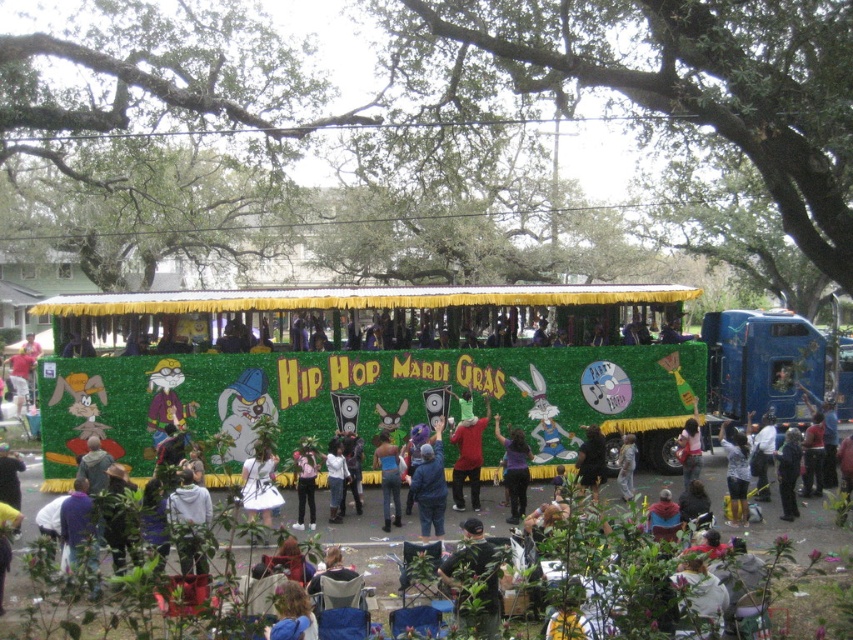
You are a photographer trying to capture both the blue denim jacket at center and the white cotton shirt at center in a single frame. Which one should you focus on first to ensure both are in the shot?

The blue denim jacket at center is taller than the white cotton shirt at center, so focus on the blue denim jacket at center first to ensure both fit within the frame.

You are a photographer at the Mardi Gras parade and want to capture both the purple matte shirt at center and the dark gray fabric jacket at center in a single photo. Which object should you position closer to the left side of your camera frame to ensure both are visible?

You should position the purple matte shirt at center closer to the left side of your camera frame because it is already to the left of the dark gray fabric jacket at center in the scene.

You are a photographer at the Mardi Gras parade. You want to take a photo of the blue denim jacket at center. Where should you aim your camera?

You should aim your camera at point (428, 481) to capture the blue denim jacket at center.